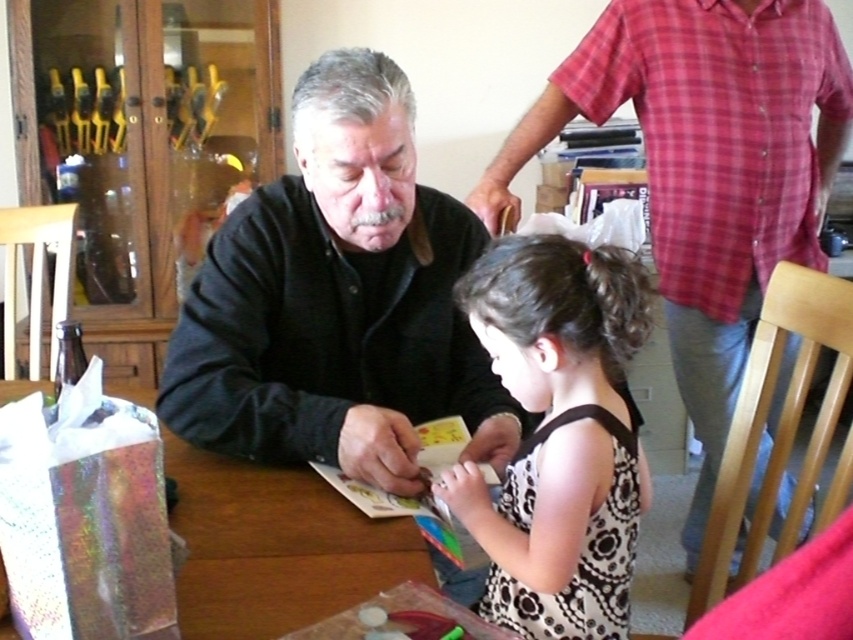
You are a photographer trying to capture a candid shot of the black matte shirt at center and the matte black sweater at left. Since you want both subjects to be in focus, which one should you focus on first to ensure the other is also sharp?

You should focus on the matte black sweater at left first because it is farther away from the camera than the black matte shirt at center, ensuring both are in focus.

You are standing in front of the table and want to place a small object on the table. You have two points on the table to choose from. The first point is at coordinates point (282,403) and the second is at point (531,360). Which point is closer to you?

→ Point (282,403) is closer to you because it is further to the viewer than point (531,360).

You are trying to find the black matte shirt at center and the matte black sweater at left in the image. According to their positions, which one is closer to the left edge of the image?

The matte black sweater at left is closer to the left edge of the image because the black matte shirt at center is to the left of it, meaning the sweater is further to the right.